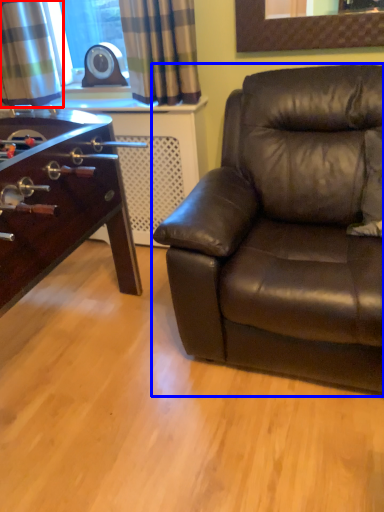
Question: Which of the following is the farthest to the observer, curtain (highlighted by a red box) or studio couch (highlighted by a blue box)?

Choices:
 (A) curtain
 (B) studio couch

Answer: (A)